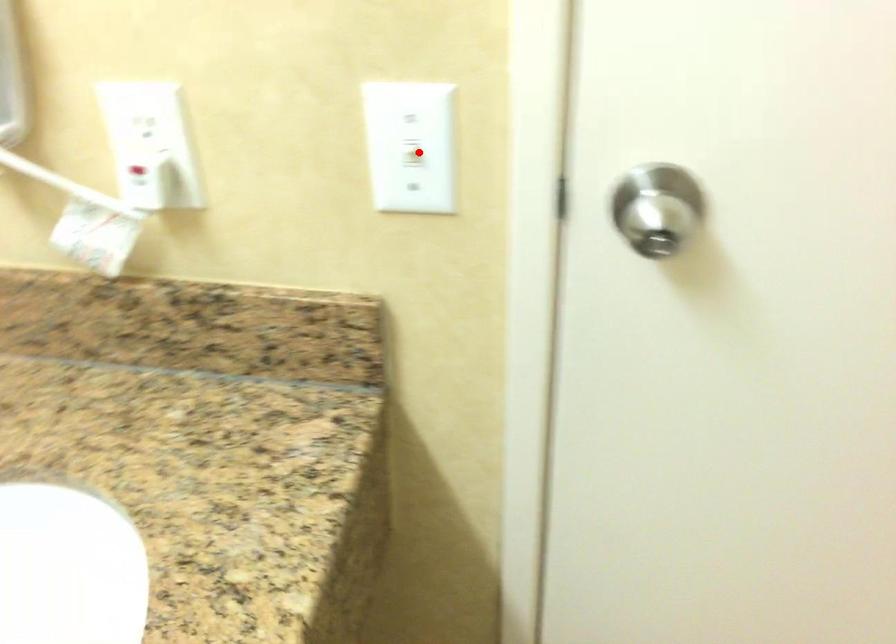
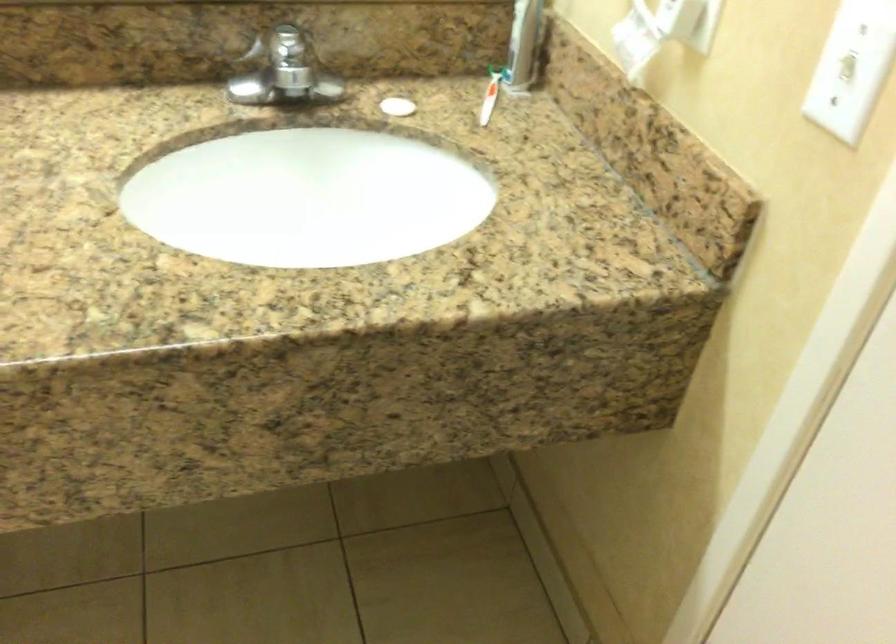
Where in the second image is the point corresponding to the highlighted location from the first image?

(851, 68)